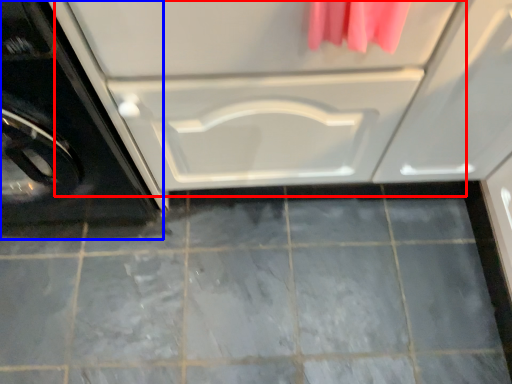
Question: Which object appears farthest to the camera in this image, drawer (highlighted by a red box) or washing machine (highlighted by a blue box)?

Choices:
 (A) drawer
 (B) washing machine

Answer: (A)